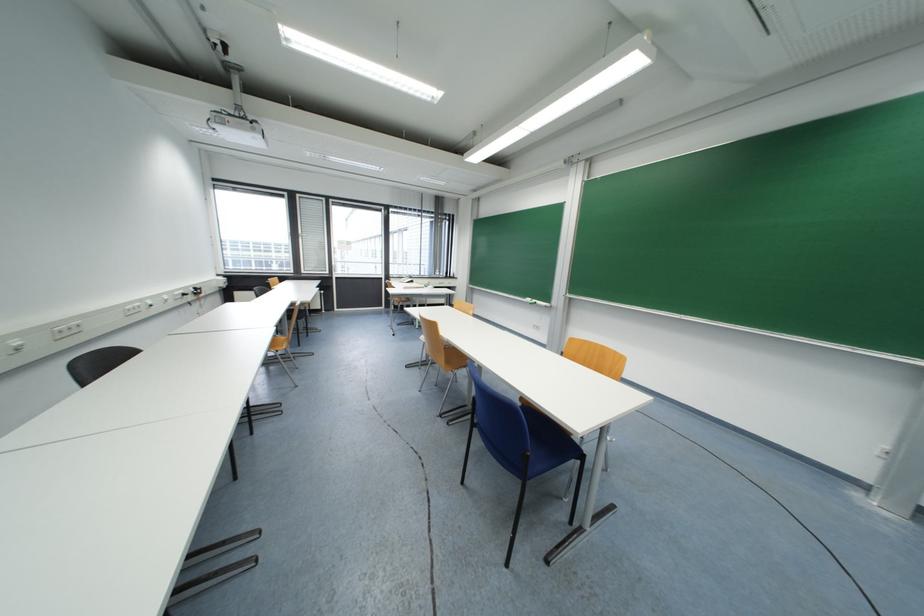
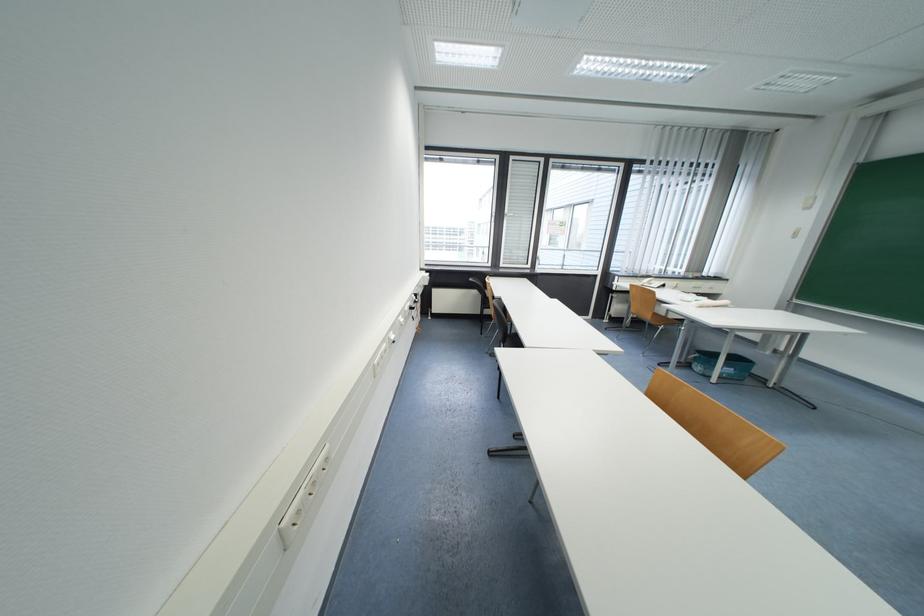
What movement of the cameraman would produce the second image?

The movement direction of the cameraman is left, forward.